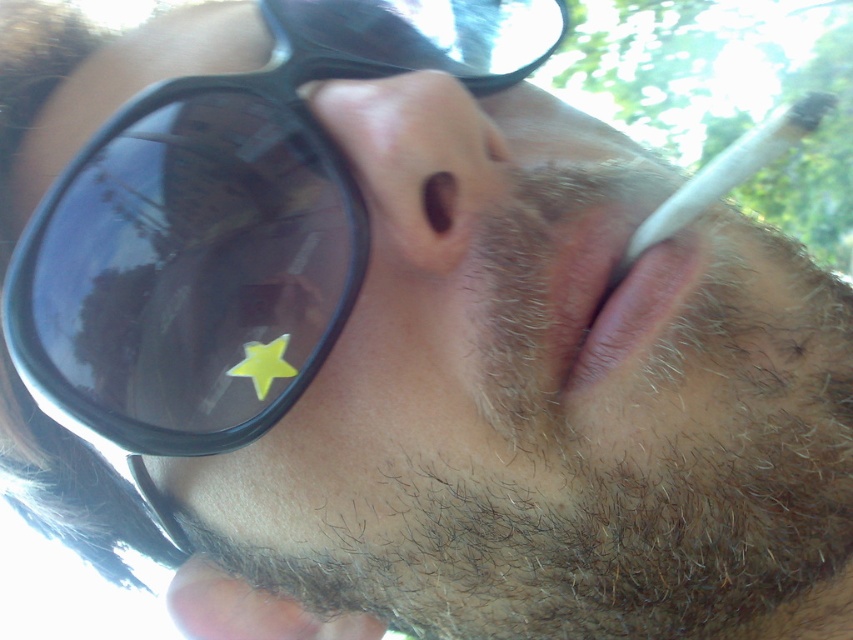
You are a photographer trying to adjust the focus of your camera to capture the black matte sunglasses at upper left. If the camera is set to focus at point coordinates of 0.350 on the x axis and 0.267 on the y axis, will the sunglasses be in focus?

The black matte sunglasses at upper left is located at point coordinates of 0.350 on the x axis and 0.267 on the y axis, so yes, the sunglasses will be in focus since the camera is set to focus at those exact coordinates.

Consider the image. You are a photographer trying to capture a closeup of the pink smooth lips at center without the black matte sunglasses at upper left blocking the view. Can you adjust your position to do so?

The black matte sunglasses at upper left is further to the viewer than the pink smooth lips at center, so moving your camera position slightly downward or backward might allow you to frame the shot so the pink smooth lips at center is visible without obstruction from the sunglasses.

You are a photographer trying to capture a candid shot of a person holding a cigarette. You are currently positioned at the camera location. The person is at point point (288, 1). If your camera has a focal length of 50mm, what is the approximate distance in meters between you and the person?

The point point (288, 1) and camera are 21.12 inches apart. Converting inches to meters, 21.12 inches is approximately 0.536 meters. Therefore, the distance between you and the person is approximately 0.536 meters.